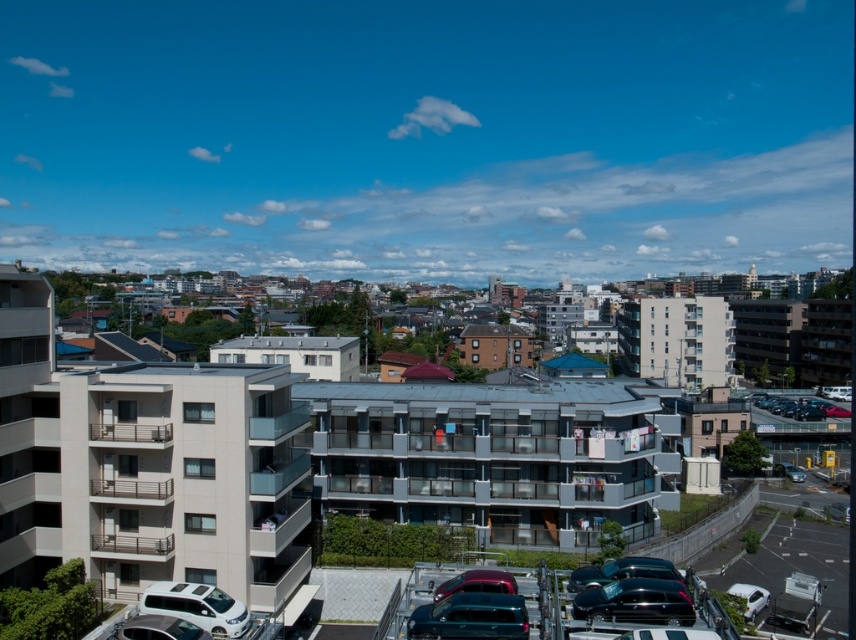
You are standing at the point with coordinates point (146, 637) and want to walk towards the residential building. Will you pass by the point with coordinates point (759, 403) on your way?

Since point (146, 637) is in front of point (759, 403), walking towards the residential building from point (146, 637) would mean moving away from point (759, 403). Therefore, you will not pass by point (759, 403) on your way.

You are a delivery person standing between the silver metallic car at lower left and the metallic silver car at lower right. The distance between them is crucial for your delivery route planning. Can you confirm if the distance between these two cars is sufficient to allow a 100 meter long delivery truck to pass through?

The distance between the silver metallic car at lower left and the metallic silver car at lower right is 96.35 meters, which is less than the 100 meter length of the delivery truck. Therefore, the truck cannot pass through the space between them.

You are a parking attendant who needs to move the teal glossy car at lower center to another lot 100 meters away. Can you safely move it without needing to back up, considering the space between it and the metallic silver car at lower right?

The distance between the teal glossy car at lower center and the metallic silver car at lower right is 91.38 meters. Since the required distance to move the teal glossy car is 100 meters, there is insufficient space. The attendant would need to back up or find a different path.